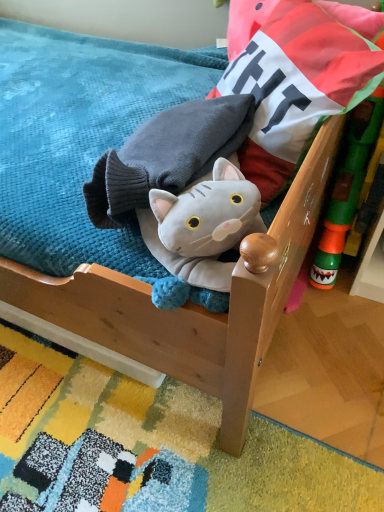
Question: Is green plastic toy at right surrounding soft blue fabric at upper left?

Choices:
 (A) yes
 (B) no

Answer: (B)

Question: Is green plastic toy at right oriented towards soft blue fabric at upper left?

Choices:
 (A) no
 (B) yes

Answer: (A)

Question: Does green plastic toy at right have a lesser height compared to soft blue fabric at upper left?

Choices:
 (A) yes
 (B) no

Answer: (B)

Question: From a real-world perspective, is green plastic toy at right on top of soft blue fabric at upper left?

Choices:
 (A) yes
 (B) no

Answer: (B)

Question: Is green plastic toy at right outside soft blue fabric at upper left?

Choices:
 (A) no
 (B) yes

Answer: (B)

Question: Is green plastic toy at right to the right of soft blue fabric at upper left from the viewer's perspective?

Choices:
 (A) no
 (B) yes

Answer: (B)

Question: From a real-world perspective, is soft blue fabric at upper left positioned under velvet cushion at upper right based on gravity?

Choices:
 (A) yes
 (B) no

Answer: (A)

Question: Can you confirm if soft blue fabric at upper left is thinner than velvet cushion at upper right?

Choices:
 (A) no
 (B) yes

Answer: (B)

Question: Is soft blue fabric at upper left not near velvet cushion at upper right?

Choices:
 (A) yes
 (B) no

Answer: (B)

Question: Can you confirm if soft blue fabric at upper left is shorter than velvet cushion at upper right?

Choices:
 (A) no
 (B) yes

Answer: (B)

Question: Is soft blue fabric at upper left to the left of velvet cushion at upper right from the viewer's perspective?

Choices:
 (A) yes
 (B) no

Answer: (A)

Question: Is soft blue fabric at upper left bigger than velvet cushion at upper right?

Choices:
 (A) yes
 (B) no

Answer: (B)

Question: Can you confirm if soft blue fabric at upper left is bigger than green plastic toy at right?

Choices:
 (A) no
 (B) yes

Answer: (B)